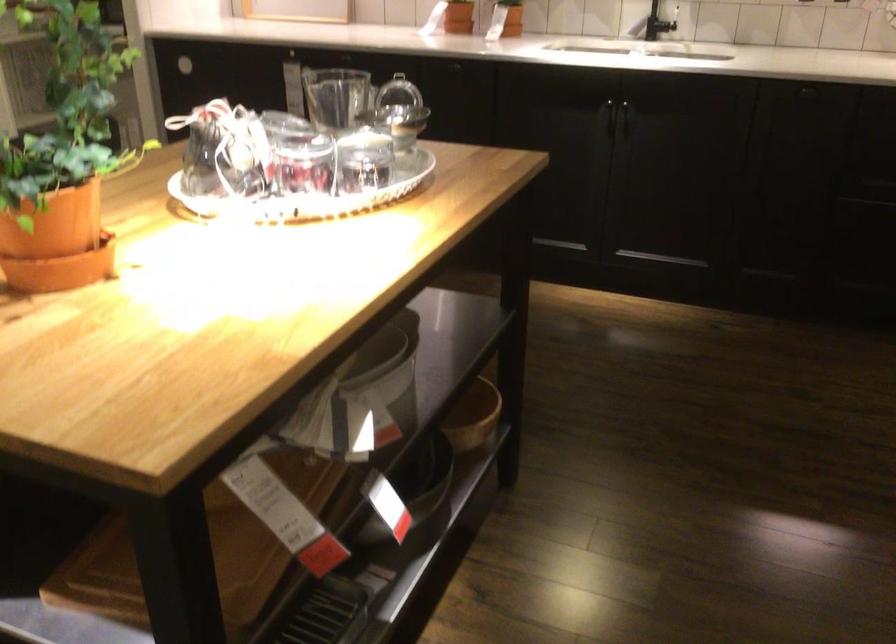
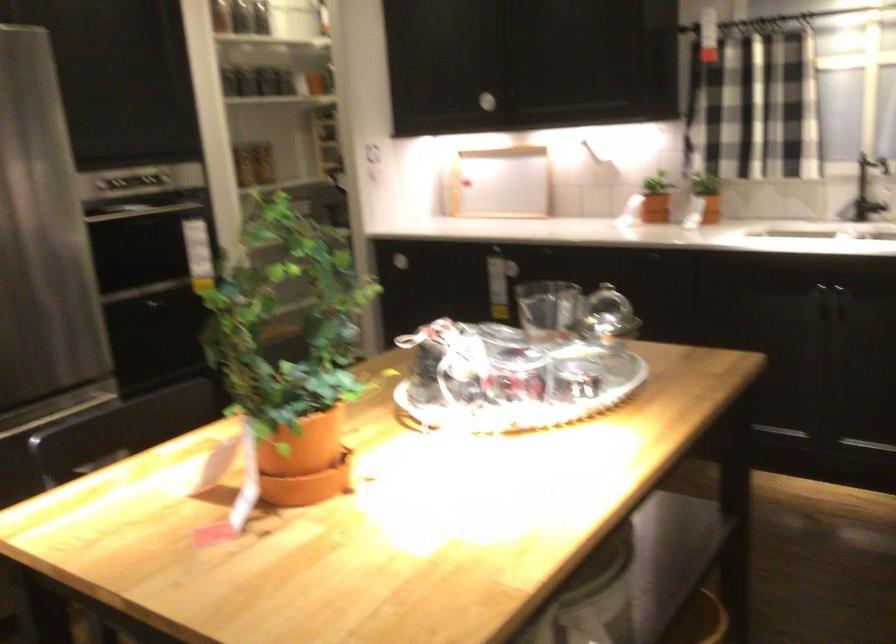
Question: The first image is from the beginning of the video and the second image is from the end. How did the camera likely rotate when shooting the video?

Choices:
 (A) Left
 (B) Right
 (C) Up
 (D) Down

Answer: (A)